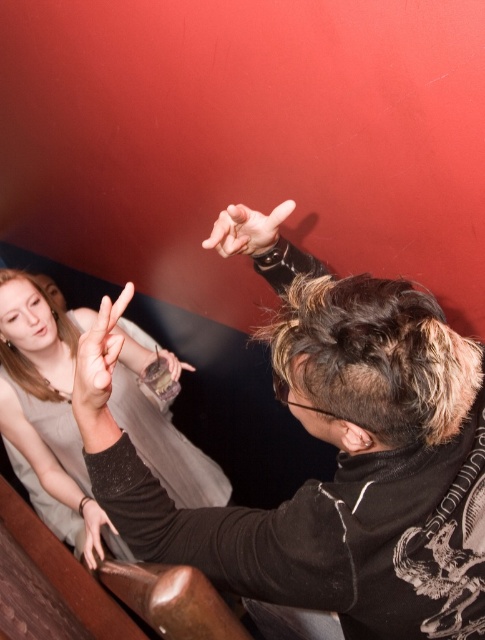
Question: Does black matte jacket at upper center appear under smooth skin hand at center?

Choices:
 (A) no
 (B) yes

Answer: (B)

Question: Considering the real-world distances, which object is farthest from the smooth skin hand at lower left?

Choices:
 (A) matte black dress at upper left
 (B) smooth skin hand at center

Answer: (B)

Question: Estimate the real-world distances between objects in this image. Which object is farther from the matte black hand at upper center?

Choices:
 (A) smooth skin hand at lower left
 (B) matte black dress at upper left
 (C) smooth skin hand at center
 (D) black matte jacket at upper center

Answer: (B)

Question: Does black matte jacket at upper center appear on the left side of smooth skin hand at lower left?

Choices:
 (A) yes
 (B) no

Answer: (B)

Question: Which object is positioned closest to the smooth skin hand at center?

Choices:
 (A) smooth skin hand at lower left
 (B) matte black hand at upper center
 (C) black matte jacket at upper center
 (D) matte black dress at upper left

Answer: (B)

Question: Is black matte jacket at upper center further to the viewer compared to matte black hand at upper center?

Choices:
 (A) yes
 (B) no

Answer: (B)